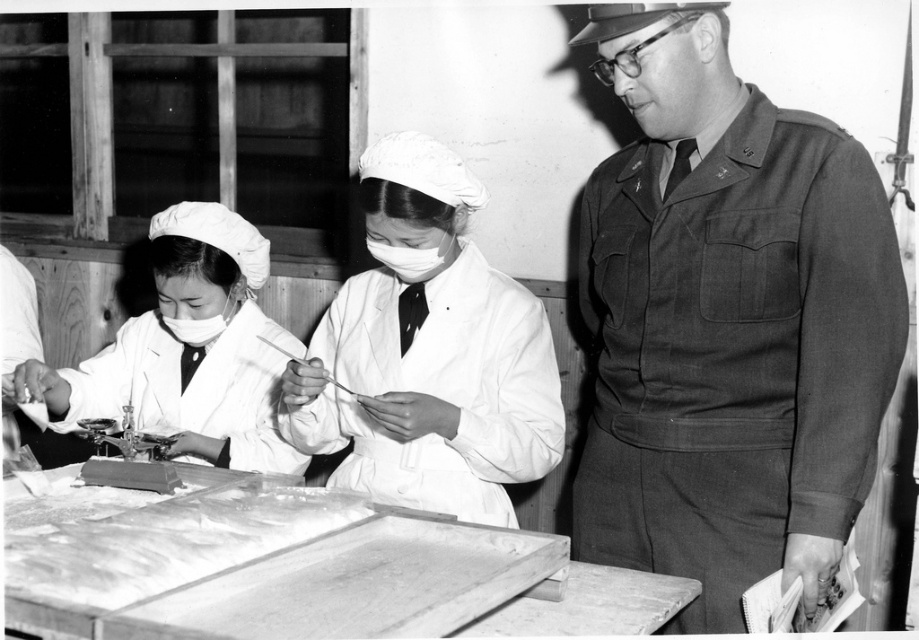
Which is below, wooden tray at lower center or white matte uniform at center?

wooden tray at lower center is below.

Who is more forward, (x=509, y=548) or (x=505, y=352)?

Positioned in front is point (x=509, y=548).

Where is `wooden tray at lower center`? The height and width of the screenshot is (640, 919). wooden tray at lower center is located at coordinates (291, 570).

Locate an element on the screen. The width and height of the screenshot is (919, 640). wooden tray at lower center is located at coordinates (x=291, y=570).

Is uniformed man at right to the left of matte white mask at left from the viewer's perspective?

In fact, uniformed man at right is to the right of matte white mask at left.

Does point (654, 52) lie in front of point (210, 326)?

Yes, it is.

The image size is (919, 640). In order to click on uniformed man at right in this screenshot , I will do `click(727, 323)`.

Is point (118, 529) more distant than point (149, 419)?

No, (118, 529) is closer to viewer.

Who is positioned more to the left, wooden tray at lower center or white matte lab coat at center?

Positioned to the left is white matte lab coat at center.

Is point (491, 556) less distant than point (163, 321)?

Yes, it is in front of point (163, 321).

Where is `wooden tray at lower center`? wooden tray at lower center is located at coordinates (291, 570).